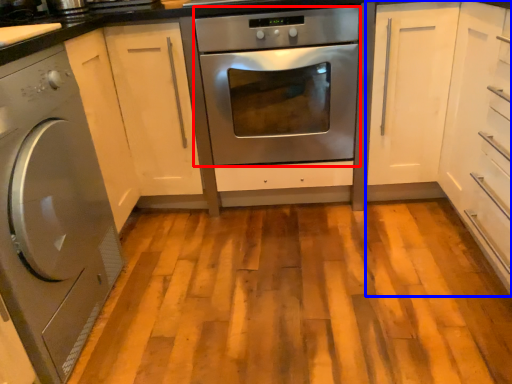
Question: Which of the following is the farthest to the observer, oven (highlighted by a red box) or cabinetry (highlighted by a blue box)?

Choices:
 (A) oven
 (B) cabinetry

Answer: (A)